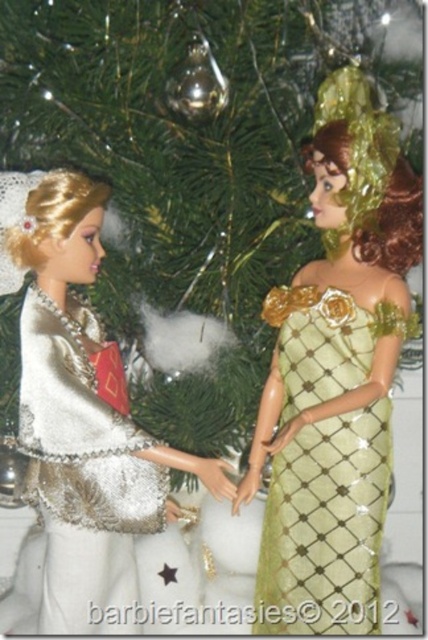
You are a photographer setting up for a Christmas photo shoot. You need to ensure that the gold sequined dress at center and the white sequined dress at left are visible in the frame. Given that the camera is positioned to capture both dresses, which dress should be placed closer to the camera to ensure both are fully visible?

The gold sequined dress at center is taller than the white sequined dress at left. To ensure both are fully visible, the white sequined dress at left should be placed closer to the camera so that its shorter height doesn

You are a photographer setting up a shoot in front of a Christmas tree. You need to position two dolls so that the gold sequined dress at center is visible above the white sequined dress at left. Is the current arrangement suitable for this requirement?

The gold sequined dress at center is located below the white sequined dress at left, so the current arrangement is not suitable because the gold sequined dress at center would be obscured by the white sequined dress at left.

What are the coordinates of the gold sequined dress at center?

The coordinates of the gold sequined dress at center are at point (326,525).